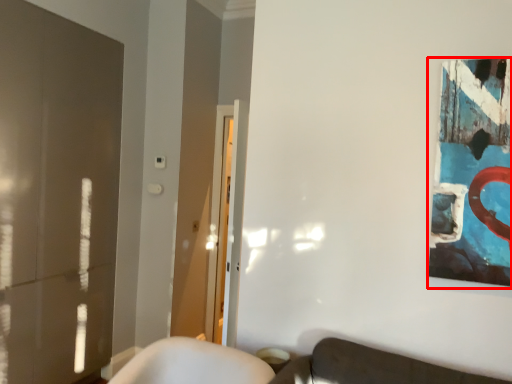
Question: From the image's perspective, where is picture frame (annotated by the red box) located relative to glass door?

Choices:
 (A) above
 (B) below

Answer: (A)